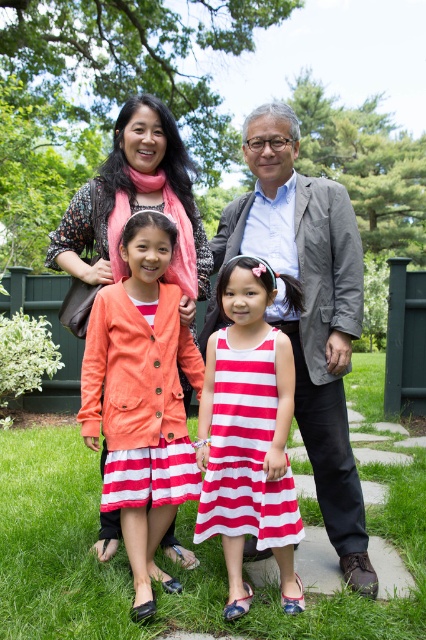
Question: Is green grass at lower center wider than striped cotton dress at center?

Choices:
 (A) yes
 (B) no

Answer: (A)

Question: Is green grass at lower center positioned at the back of gray textured blazer at center?

Choices:
 (A) yes
 (B) no

Answer: (A)

Question: Which object appears closest to the camera in this image?

Choices:
 (A) striped cotton dress at center
 (B) matte coral jacket at center
 (C) gray textured blazer at center

Answer: (A)

Question: Considering the real-world distances, which object is farthest from the coral fabric jacket at center?

Choices:
 (A) striped cotton dress at center
 (B) matte coral jacket at center
 (C) gray textured blazer at center

Answer: (B)

Question: Which point appears farthest from the camera in this image?

Choices:
 (A) (52, 570)
 (B) (249, 390)
 (C) (143, 614)

Answer: (A)

Question: Can you confirm if coral fabric jacket at center is positioned below striped cotton dress at center?

Choices:
 (A) yes
 (B) no

Answer: (B)